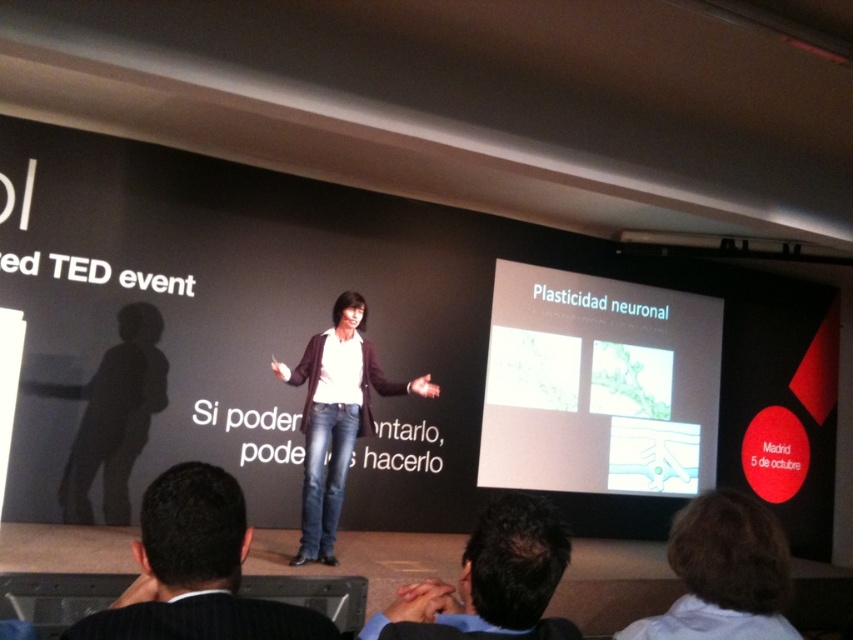
Question: Can you confirm if black suit at lower left is positioned below dark brown hair at upper right?

Choices:
 (A) yes
 (B) no

Answer: (B)

Question: Considering the real-world distances, which object is farthest from the white paper at center?

Choices:
 (A) black suit at lower left
 (B) dark brown hair at upper right
 (C) dark brown hair at upper center
 (D) matte white slide at center

Answer: (A)

Question: Where is white paper at center located in relation to denim jeans at center in the image?

Choices:
 (A) right
 (B) left

Answer: (A)

Question: Does dark brown hair at upper right appear over dark brown hair at upper center?

Choices:
 (A) yes
 (B) no

Answer: (B)

Question: Among these objects, which one is nearest to the camera?

Choices:
 (A) dark brown hair at upper center
 (B) black suit at lower left
 (C) white paper at center

Answer: (B)

Question: Which object appears closest to the camera in this image?

Choices:
 (A) dark brown hair at upper center
 (B) matte white slide at center

Answer: (A)